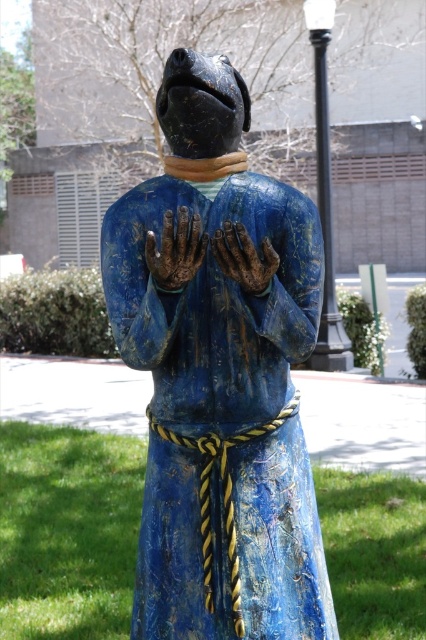
You are a visitor at a park and see the blue painted wood statue at center and the brown matte hand at center. Which object is located higher up in the image?

The brown matte hand at center is higher up because the blue painted wood statue at center is below it.